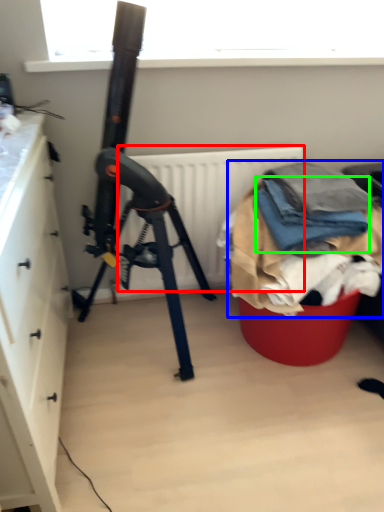
Question: Which is farther away from radiator (highlighted by a red box)? waste (highlighted by a blue box) or clothing (highlighted by a green box)?

Choices:
 (A) waste
 (B) clothing

Answer: (B)